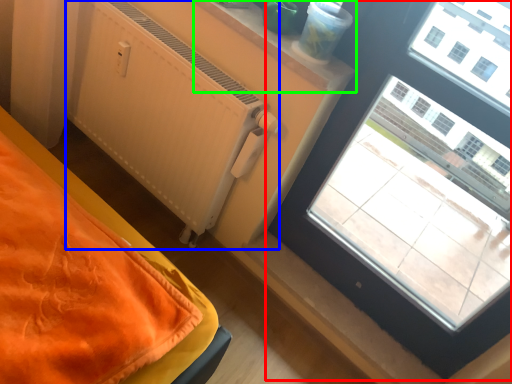
Question: Based on their relative distances, which object is nearer to window (highlighted by a red box)? Choose from radiator (highlighted by a blue box) and window sill (highlighted by a green box).

Choices:
 (A) radiator
 (B) window sill

Answer: (B)